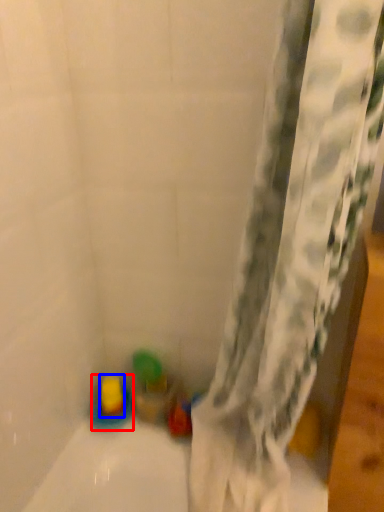
Question: Which point is closer to the camera, toy (highlighted by a red box) or toy (highlighted by a blue box)?

Choices:
 (A) toy
 (B) toy

Answer: (A)